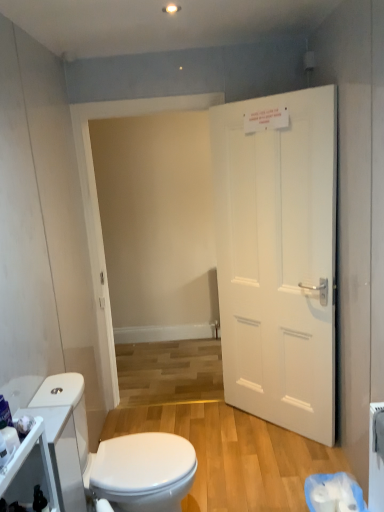
You are a GUI agent. You are given a task and a screenshot of the screen. Output one action in this format:
    pyautogui.click(x=<x>, y=<y>)
    Task: Click on the free spot below white matte door at right (from a real-world perspective)
    This screenshot has height=512, width=384.
    Given the screenshot: What is the action you would take?
    pyautogui.click(x=276, y=428)